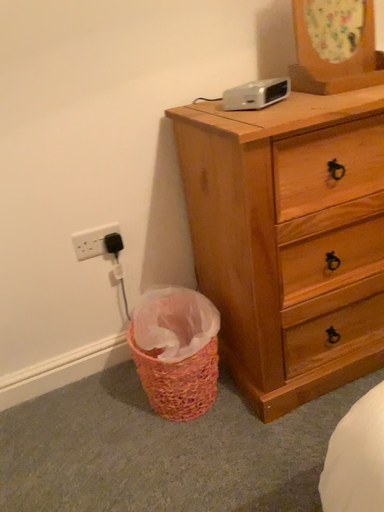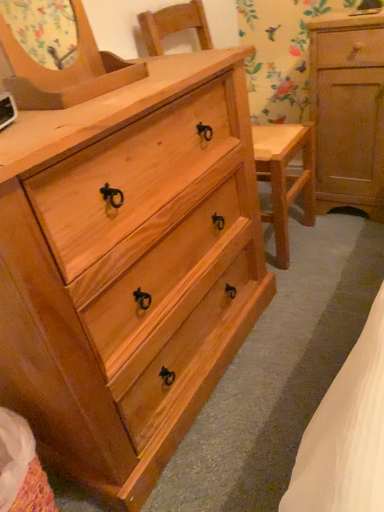
Question: How did the camera likely rotate when shooting the video?

Choices:
 (A) rotated downward
 (B) rotated upward

Answer: (B)